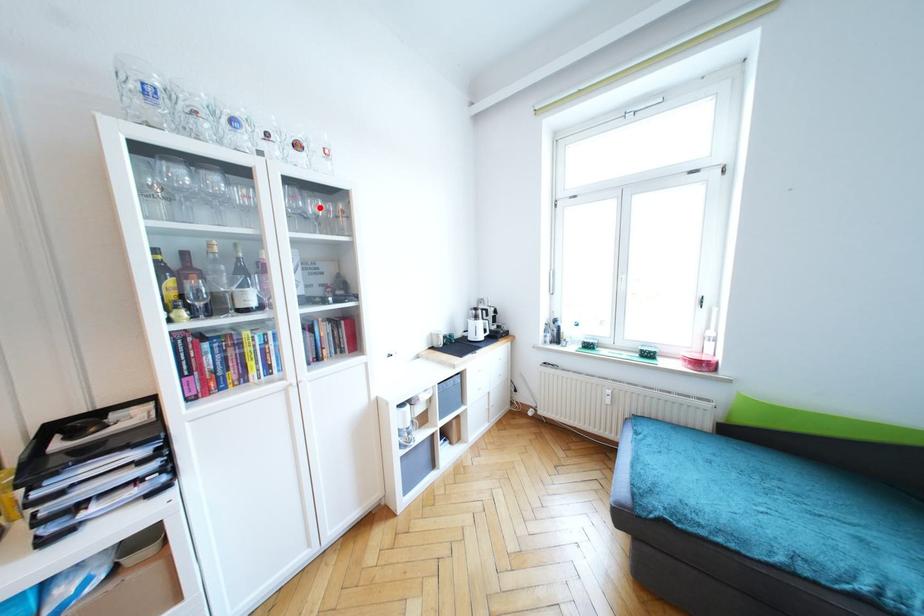
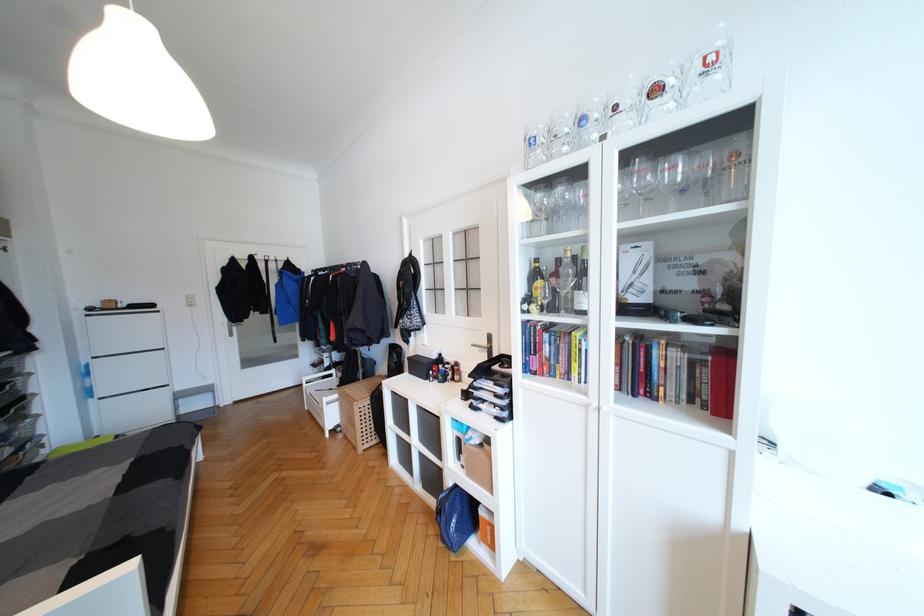
The point at the highlighted location is marked in the first image. Where is the corresponding point in the second image?

(679, 171)